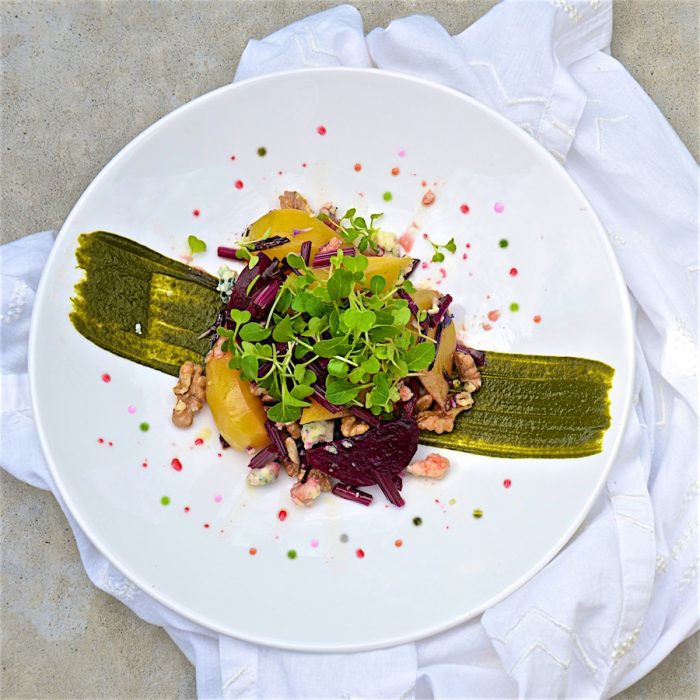
Identify the location of white napkin. This screenshot has height=700, width=700. (595, 570).